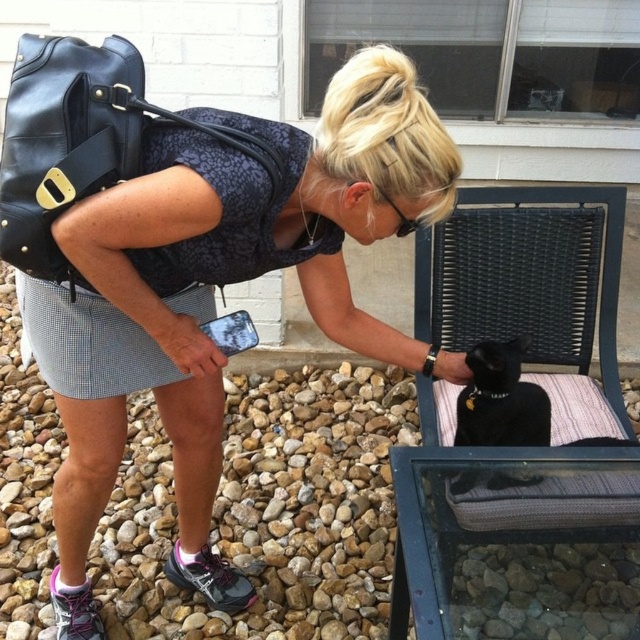
Based on the coordinates provided in the description, where is the black woven fabric folding chair at lower right located in the image?

The black woven fabric folding chair at lower right is located at point (522, 448) in the image.

You are a delivery person who needs to place a package on the ground near the matte black purse at upper left. According to the coordinates provided, where should you place the package relative to the purse?

The matte black purse at upper left is located at coordinates point (220, 285), so you should place the package near that position.

You are a delivery person who needs to place a small package on either the matte black purse at upper left or the black matte fur cat at lower right. Which object can the package be placed on without exceeding its surface area?

The matte black purse at upper left is bigger than the black matte fur cat at lower right, so the small package can be placed on the matte black purse at upper left without exceeding its surface area.